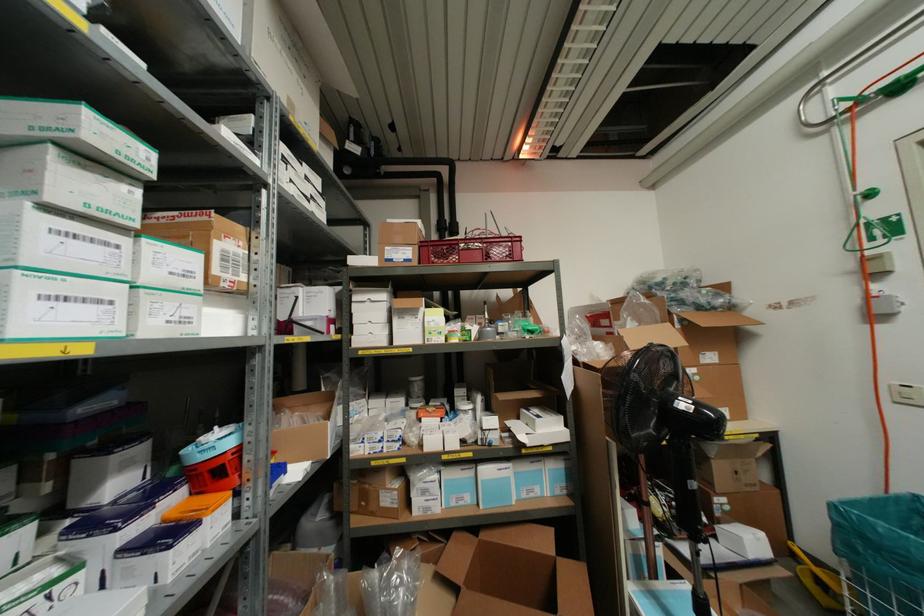
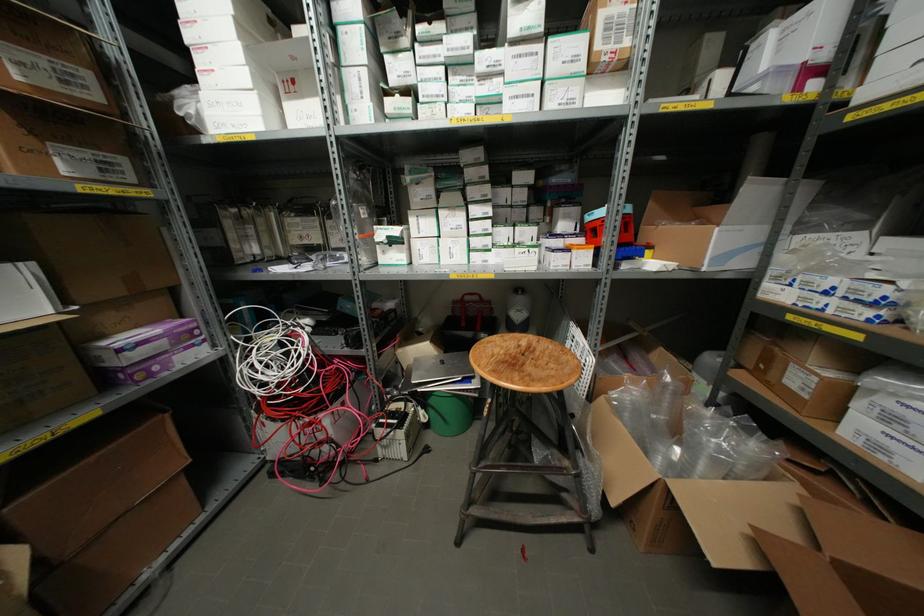
How did the camera likely rotate?

The camera's rotation is toward left-down.